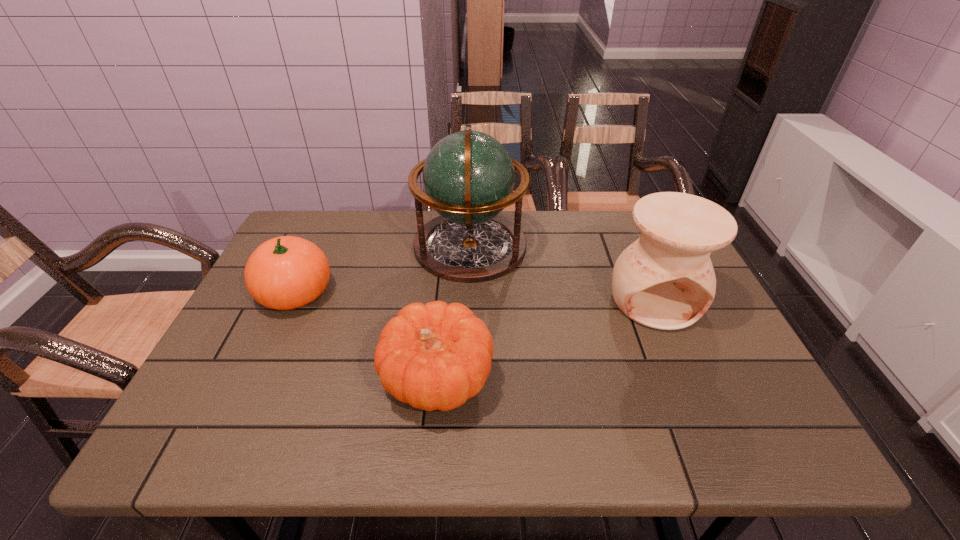
The image size is (960, 540). What are the coordinates of `vacant space that satisfies the following two spatial constraints: 1. on the front-facing side of the tallest object; 2. on the front side of the left pumpkin` in the screenshot? It's located at click(468, 292).